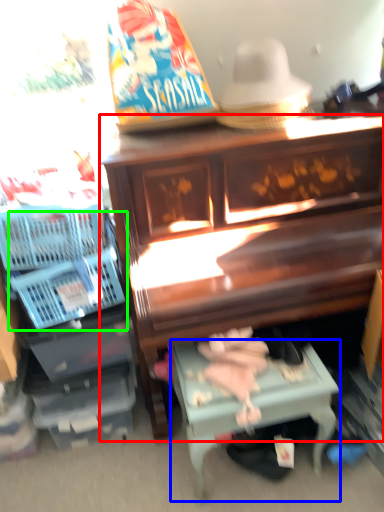
Question: Which is nearer to the furniture (highlighted by a red box)? table (highlighted by a blue box) or basket (highlighted by a green box).

Choices:
 (A) table
 (B) basket

Answer: (A)